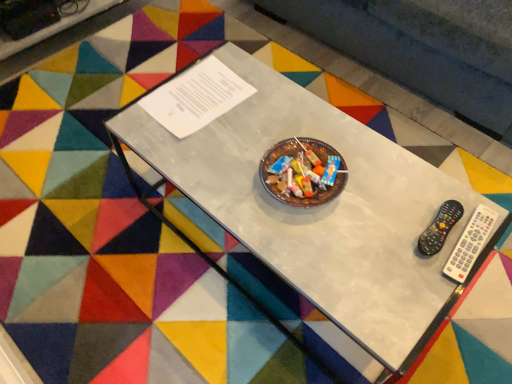
Question: Can you see metallic glass table at center touching white plastic remote at right?

Choices:
 (A) no
 (B) yes

Answer: (A)

Question: Is metallic glass table at center facing away from white plastic remote at right?

Choices:
 (A) yes
 (B) no

Answer: (B)

Question: From the image's perspective, is metallic glass table at center above white plastic remote at right?

Choices:
 (A) no
 (B) yes

Answer: (B)

Question: From a real-world perspective, is metallic glass table at center under white plastic remote at right?

Choices:
 (A) yes
 (B) no

Answer: (A)

Question: Can you confirm if metallic glass table at center is positioned to the left of white plastic remote at right?

Choices:
 (A) no
 (B) yes

Answer: (B)

Question: Do you think black plastic remote at right is within metallic glass table at center, or outside of it?

Choices:
 (A) outside
 (B) inside

Answer: (B)

Question: Is black plastic remote at right to the left or to the right of metallic glass table at center in the image?

Choices:
 (A) left
 (B) right

Answer: (B)

Question: From the image's perspective, is black plastic remote at right positioned above or below metallic glass table at center?

Choices:
 (A) below
 (B) above

Answer: (A)

Question: Is black plastic remote at right wider or thinner than metallic glass table at center?

Choices:
 (A) wide
 (B) thin

Answer: (B)

Question: From a real-world perspective, relative to metallic glass table at center, is white plastic remote at right vertically above or below?

Choices:
 (A) below
 (B) above

Answer: (B)

Question: Considering the relative positions of white plastic remote at right and metallic glass table at center in the image provided, is white plastic remote at right to the left or to the right of metallic glass table at center?

Choices:
 (A) right
 (B) left

Answer: (A)

Question: Considering the positions of white plastic remote at right and metallic glass table at center in the image, is white plastic remote at right wider or thinner than metallic glass table at center?

Choices:
 (A) wide
 (B) thin

Answer: (B)

Question: From their relative heights in the image, would you say white plastic remote at right is taller or shorter than metallic glass table at center?

Choices:
 (A) short
 (B) tall

Answer: (A)

Question: Is metallic glass table at center inside the boundaries of white plastic remote at right, or outside?

Choices:
 (A) outside
 (B) inside

Answer: (A)

Question: In terms of size, does metallic glass table at center appear bigger or smaller than white plastic remote at right?

Choices:
 (A) small
 (B) big

Answer: (B)